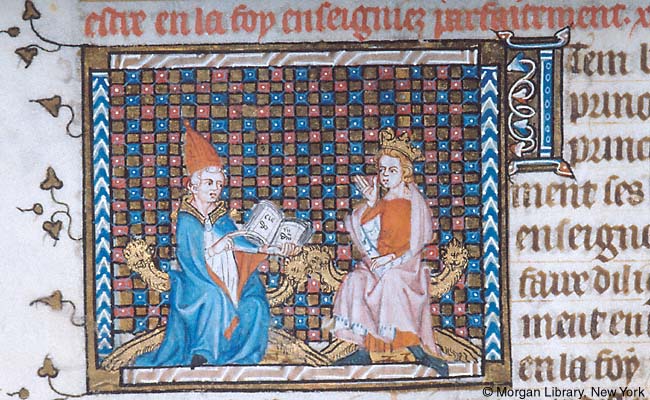
This screenshot has height=400, width=650. In order to click on book in this screenshot , I will do `click(275, 228)`, `click(268, 236)`.